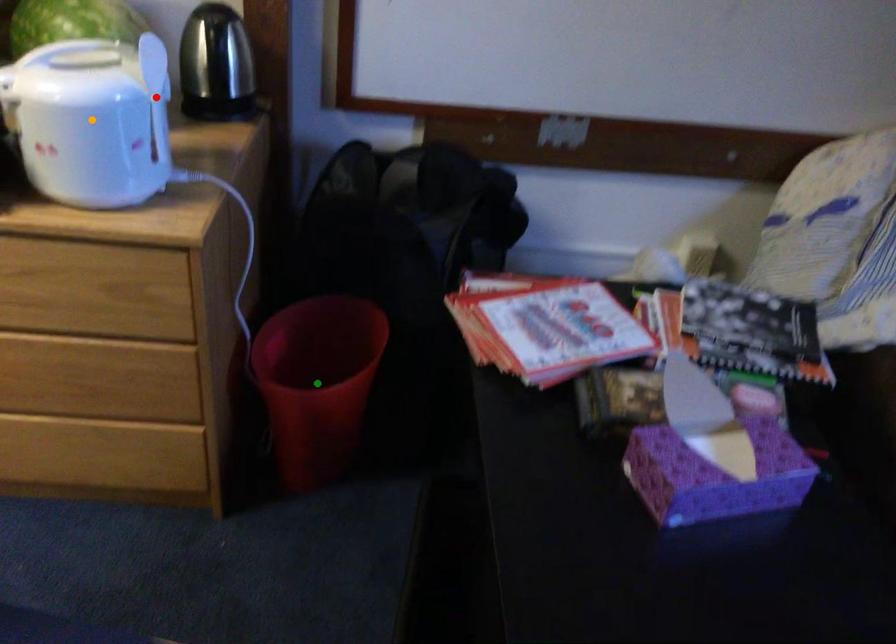
Order these from nearest to farthest:
A) orange point
B) green point
C) red point

orange point < red point < green point